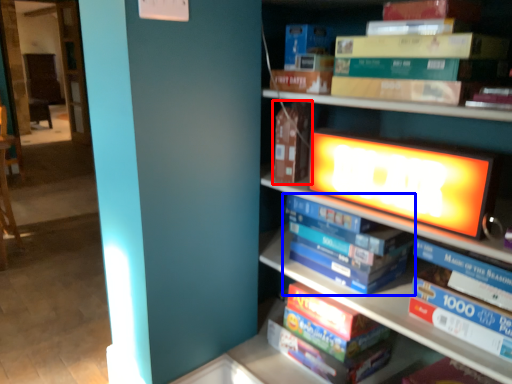
Question: Which of the following is the closest to the observer, paperback book (highlighted by a red box) or book (highlighted by a blue box)?

Choices:
 (A) paperback book
 (B) book

Answer: (B)